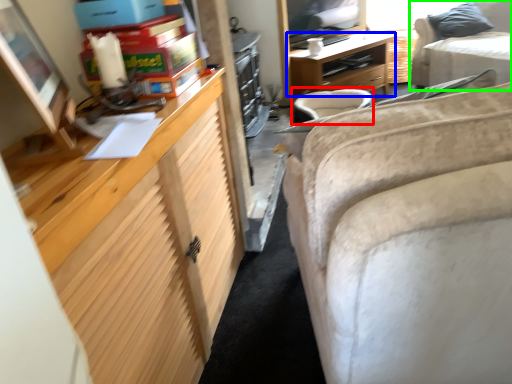
Question: Which object is positioned closest to swivel chair (highlighted by a red box)? Select from desk (highlighted by a blue box) and studio couch (highlighted by a green box).

Choices:
 (A) desk
 (B) studio couch

Answer: (A)